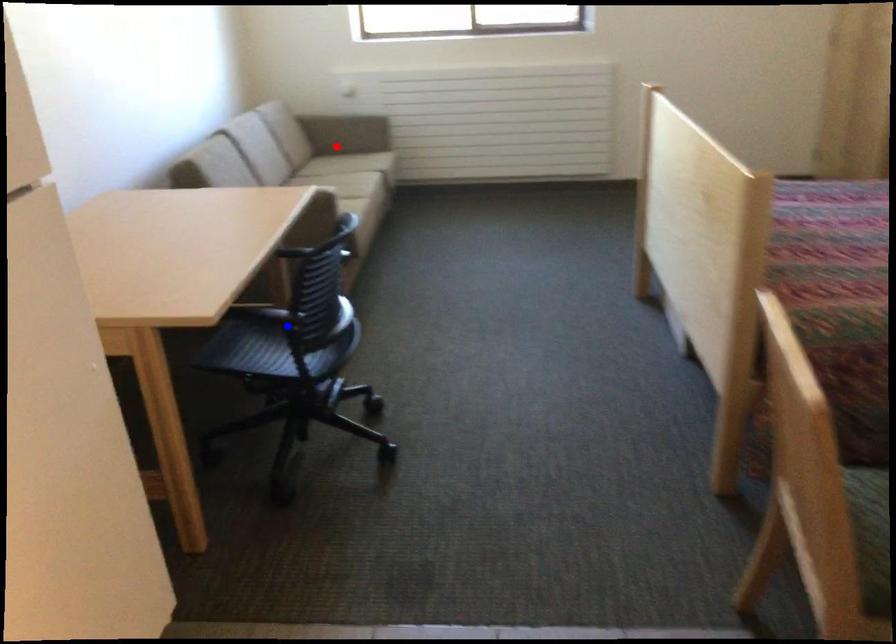
Question: In the image, two points are highlighted. Which point is nearer to the camera? Reply with the corresponding letter.

Choices:
 (A) blue point
 (B) red point

Answer: (A)